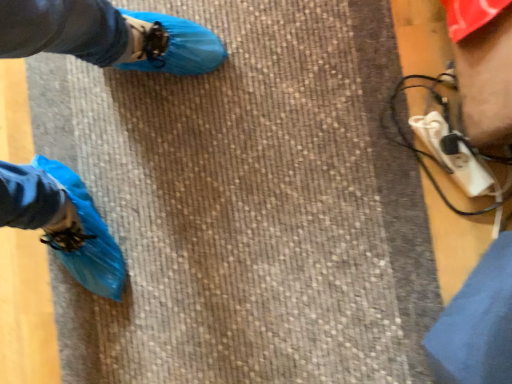
What do you see at coordinates (453, 155) in the screenshot? I see `white plastic plug at lower right` at bounding box center [453, 155].

This screenshot has width=512, height=384. I want to click on white plastic plug at lower right, so click(453, 155).

Identify the location of white plastic plug at lower right. The height and width of the screenshot is (384, 512). (453, 155).